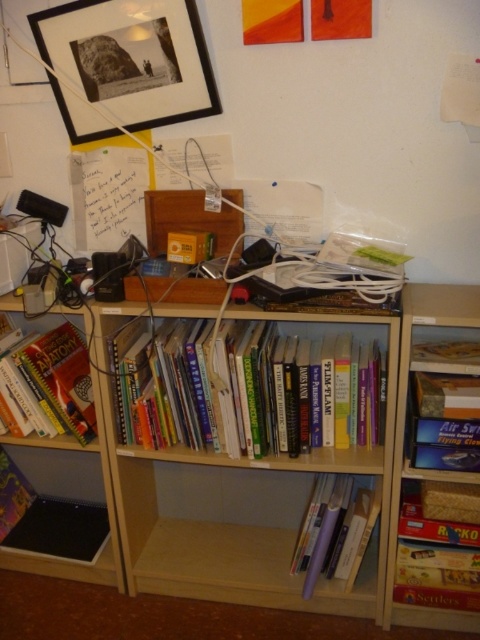
You are organizing a small toy that is 10 cm tall. You have two options to place it on the light wood shelf at lower center or the wooden board game at lower right. Which shelf or surface can accommodate the toy without it falling over?

The light wood shelf at lower center has a greater height compared to wooden board game at lower right, so the toy can be placed on the light wood shelf at lower center where there is enough space to prevent it from falling over.

You are organizing a library and need to determine if the light wood bookcase at center can fit vertically on a shelf that is 1.2 meters tall. Given the height of the hardcover books at center, can it fit?

The light wood bookcase at center is taller than the hardcover books at center. Since the shelf is 1.2 meters tall, but we don not know the exact height of the hardcover books, we cannot definitively determine if the bookcase will fit. More information is needed about the height of the hardcover books.

You are trying to place a 12 inch long decorative item on the bookshelf. You see the light wood shelf at lower center and the wooden board game at lower right. Is there enough space between them to fit your item?

The distance between the light wood shelf at lower center and the wooden board game at lower right is 13.10 inches, which is more than enough to fit a 12 inch long decorative item.